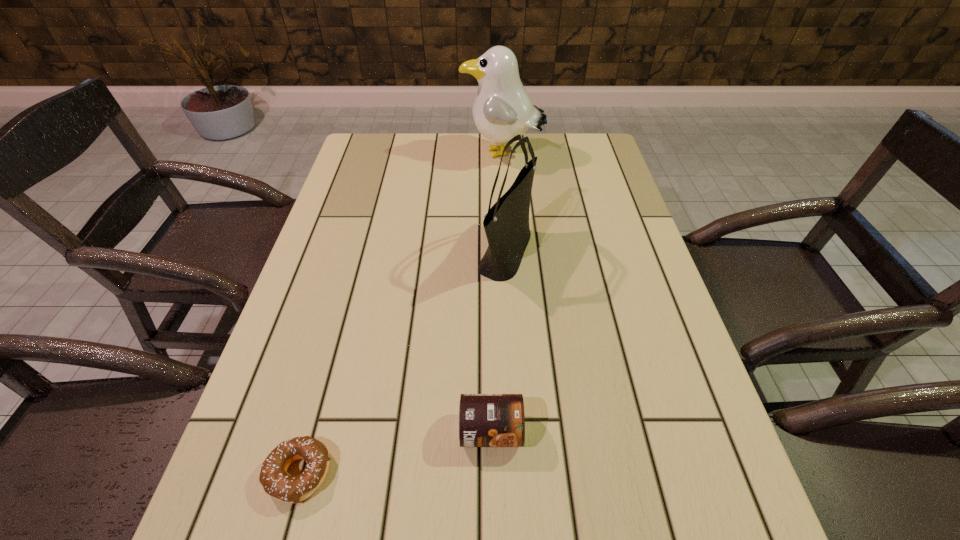
Locate an element on the screen. This screenshot has height=540, width=960. free point between the can and the farthest object is located at coordinates (496, 293).

This screenshot has width=960, height=540. What are the coordinates of `vacant space that's between the shoulder bag and the doughnut` in the screenshot? It's located at (403, 363).

The image size is (960, 540). Identify the location of empty space between the leftmost object and the third tallest object. (395, 453).

Locate an element on the screen. This screenshot has height=540, width=960. vacant space that is in between the leftmost object and the shoulder bag is located at coordinates pos(403,363).

At what (x,y) coordinates should I click in order to perform the action: click on empty space that is in between the shortest object and the second shortest object. Please return your answer as a coordinate pair (x, y). Image resolution: width=960 pixels, height=540 pixels. Looking at the image, I should click on (395, 453).

I want to click on free space between the second shortest object and the shoulder bag, so click(498, 342).

Locate an element on the screen. This screenshot has width=960, height=540. vacant area between the shortest object and the second farthest object is located at coordinates click(403, 363).

Image resolution: width=960 pixels, height=540 pixels. Identify the location of blank region between the third tallest object and the shoulder bag. (498, 342).

Locate an element on the screen. the third closest object to the leftmost object is located at coordinates (502, 109).

Locate which object is the third closest to the second farthest object. Please provide its 2D coordinates. Your answer should be formatted as a tuple, i.e. [(x, y)], where the tuple contains the x and y coordinates of a point satisfying the conditions above.

[(276, 482)]